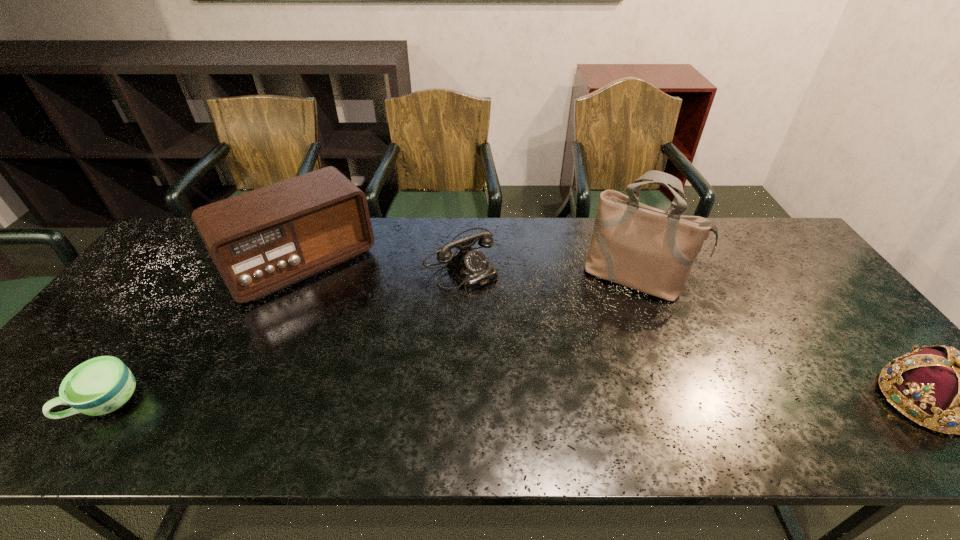
Find the location of a particular element. The height and width of the screenshot is (540, 960). object that is at the left edge is located at coordinates (101, 385).

Find the location of a particular element. This screenshot has height=540, width=960. object at the near left corner is located at coordinates (101, 385).

Locate an element on the screen. This screenshot has width=960, height=540. vacant space at the far edge of the desktop is located at coordinates (568, 230).

At what (x,y) coordinates should I click in order to perform the action: click on vacant region at the near edge. Please return your answer as a coordinate pair (x, y). Looking at the image, I should click on (215, 397).

The height and width of the screenshot is (540, 960). I want to click on free region at the left edge, so click(x=153, y=310).

Locate an element on the screen. The height and width of the screenshot is (540, 960). blank area at the far left corner is located at coordinates (183, 238).

Locate an element on the screen. The height and width of the screenshot is (540, 960). blank space at the far right corner of the desktop is located at coordinates (747, 241).

Identify the location of vacant space in between the cup and the radio receiver. (204, 333).

Where is `free space between the cup and the fourth shortest object`? free space between the cup and the fourth shortest object is located at coordinates (204, 333).

The width and height of the screenshot is (960, 540). Identify the location of vacant space that's between the second shortest object and the shoulder bag. (549, 268).